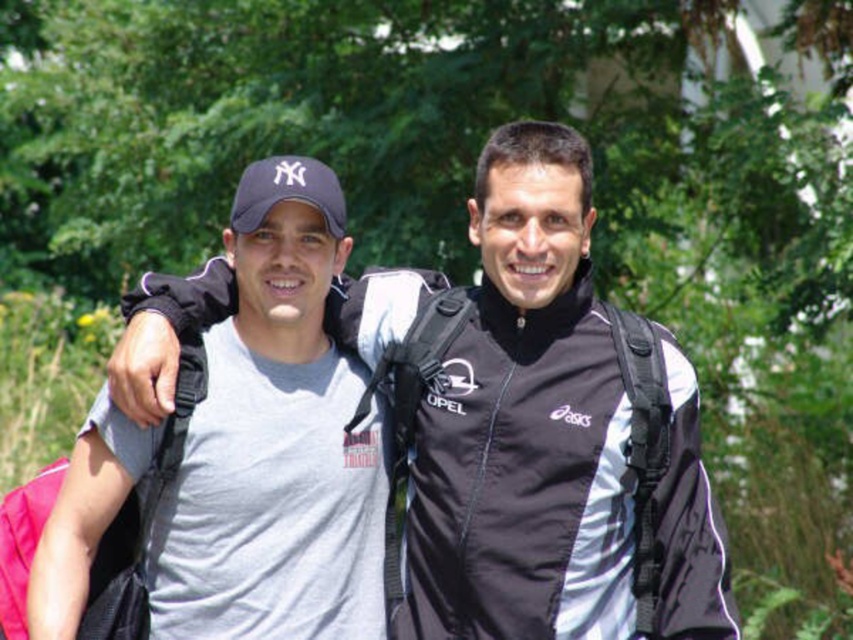
Which is below, matte black jacket at center or gray cotton t-shirt at left?

gray cotton t-shirt at left is lower down.

Based on the photo, does matte black jacket at center have a lesser width compared to gray cotton t-shirt at left?

Incorrect, matte black jacket at center's width is not less than gray cotton t-shirt at left's.

Between point (570, 154) and point (227, 516), which one is positioned in front?

Point (570, 154)

At what (x,y) coordinates should I click in order to perform the action: click on matte black jacket at center. Please return your answer as a coordinate pair (x, y). Image resolution: width=853 pixels, height=640 pixels. Looking at the image, I should click on (538, 428).

Who is taller, matte black jacket at center or matte blue baseball cap at left?

Standing taller between the two is matte black jacket at center.

Does matte black jacket at center come in front of matte blue baseball cap at left?

Yes, matte black jacket at center is closer to the viewer.

Locate an element on the screen. Image resolution: width=853 pixels, height=640 pixels. matte black jacket at center is located at coordinates (538, 428).

Where is `matte black jacket at center`? This screenshot has height=640, width=853. matte black jacket at center is located at coordinates (538, 428).

Does gray cotton t-shirt at left appear on the right side of matte blue baseball cap at left?

Answer: In fact, gray cotton t-shirt at left is to the left of matte blue baseball cap at left.

From the picture: Measure the distance from gray cotton t-shirt at left to matte blue baseball cap at left.

gray cotton t-shirt at left is 24.02 inches from matte blue baseball cap at left.

Where is `gray cotton t-shirt at left`? Image resolution: width=853 pixels, height=640 pixels. gray cotton t-shirt at left is located at coordinates (276, 442).

Identify the location of gray cotton t-shirt at left. (276, 442).